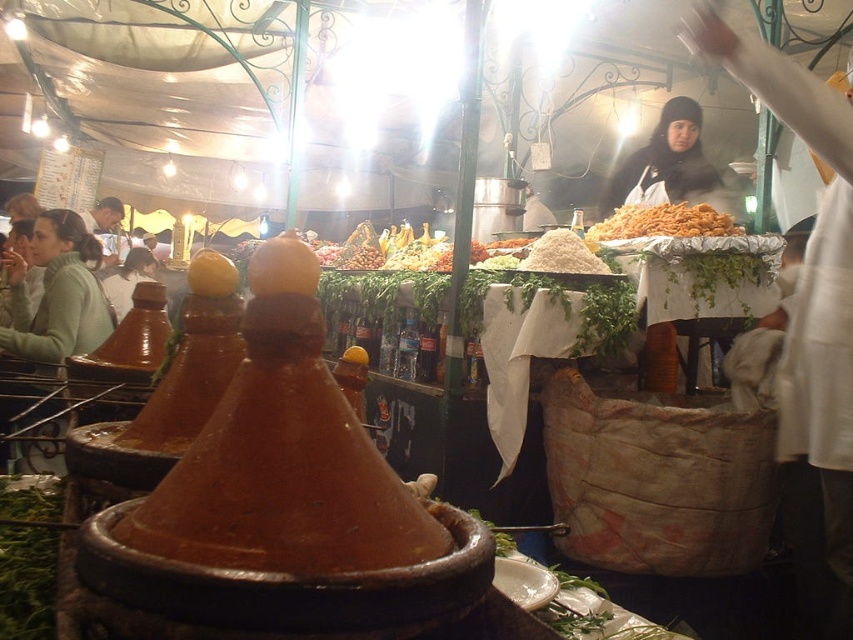
You are a customer at the food stall and want to know which dish is on top. Which one is above the other between the golden crispy fried food at center and the white powdery rice at center?

The golden crispy fried food at center is positioned over the white powdery rice at center, so the golden crispy fried food at center is above the white powdery rice at center.

You are a customer at the food stall and want to choose between the golden crispy fried food at center and the white powdery rice at center. Which one is taller?

The golden crispy fried food at center is taller than the white powdery rice at center.